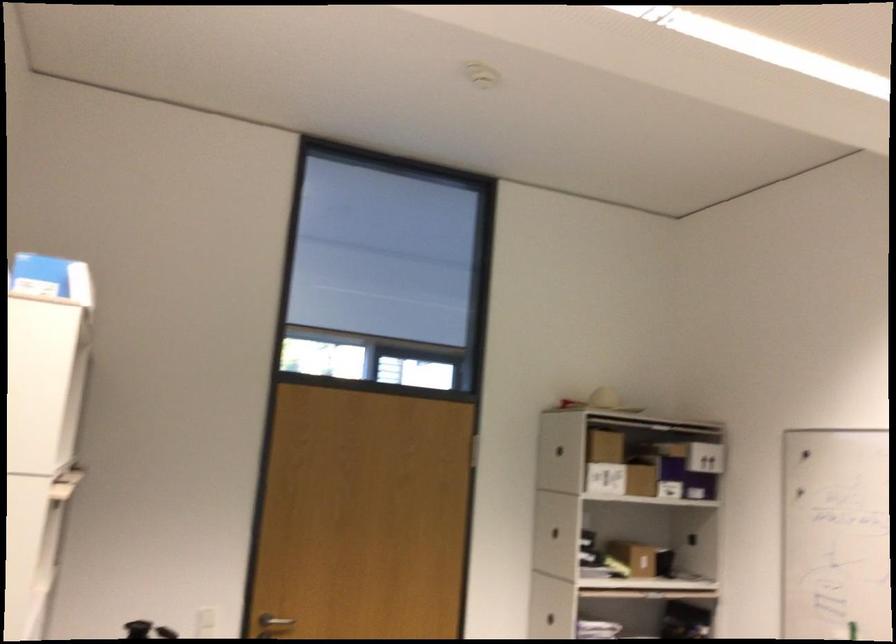
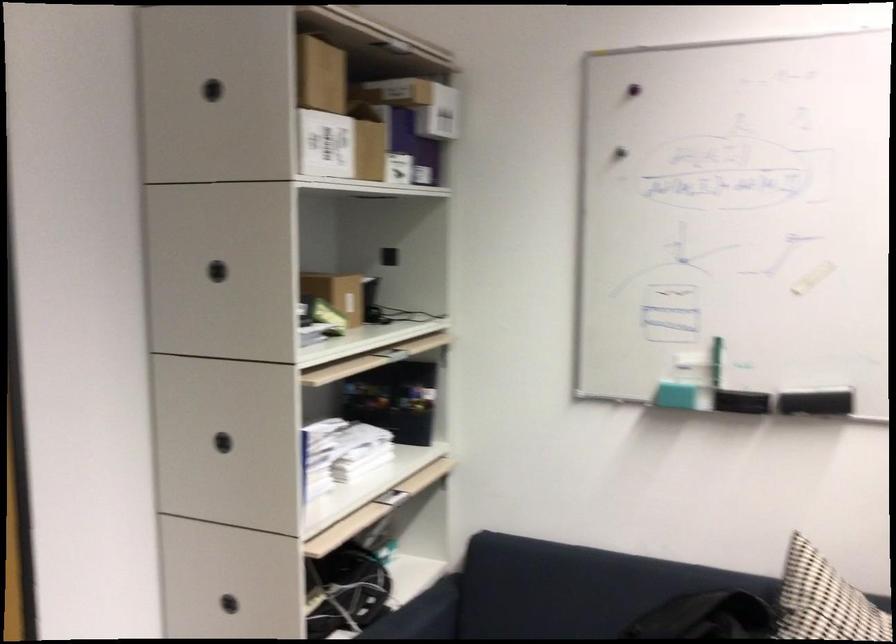
The point at (550, 533) is marked in the first image. Where is the corresponding point in the second image?

(217, 270)